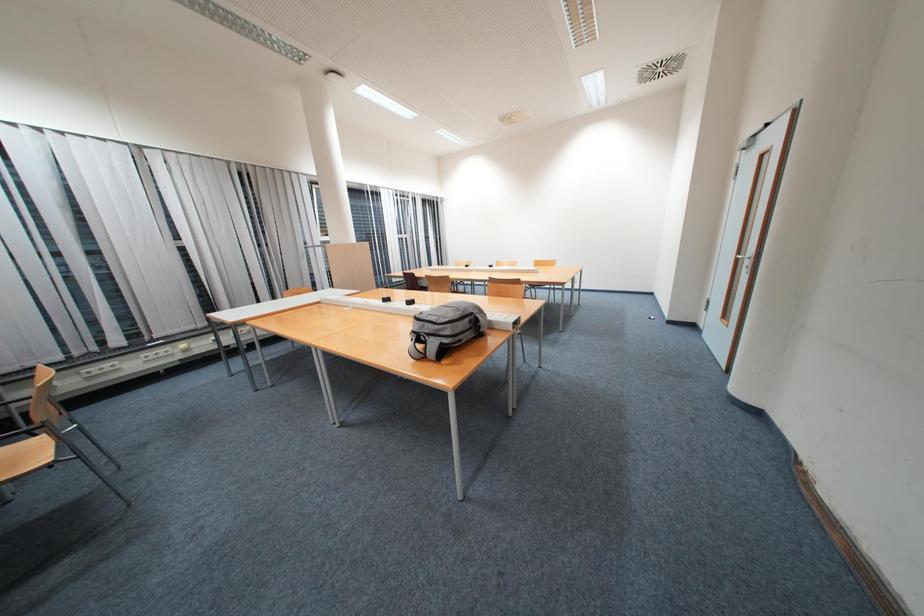
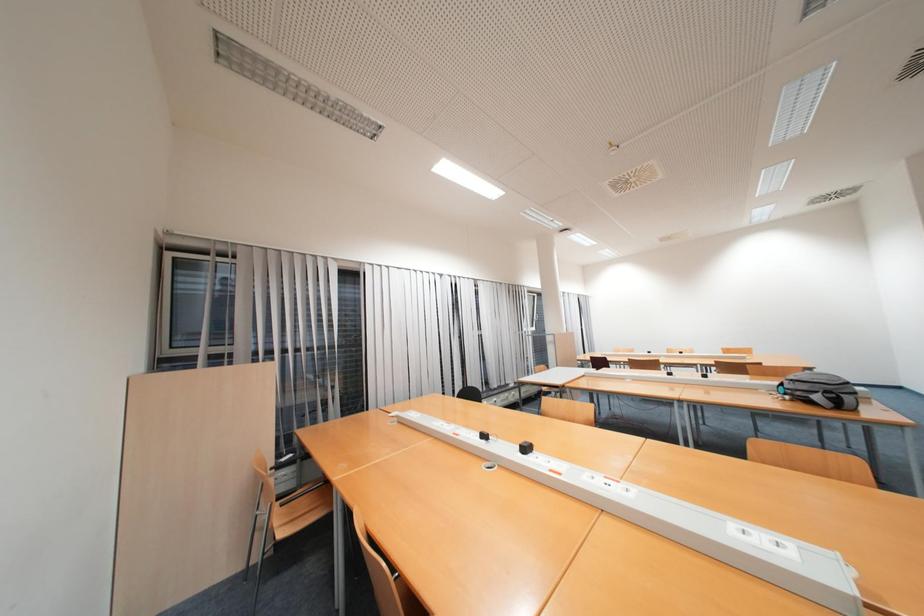
Which direction would the cameraman need to move to produce the second image?

The cameraman moved toward left, backward.